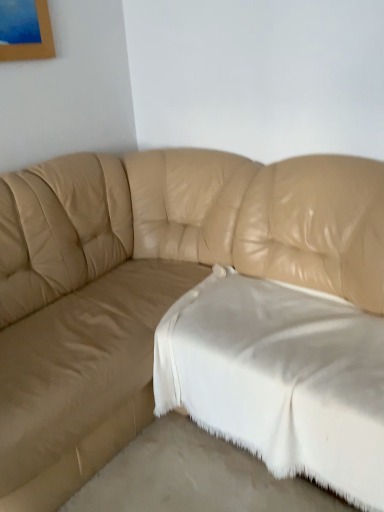
Question: From a real-world perspective, is white soft fabric at lower right located higher than white fabric at lower center?

Choices:
 (A) yes
 (B) no

Answer: (A)

Question: Is the depth of white soft fabric at lower right less than that of white fabric at lower center?

Choices:
 (A) no
 (B) yes

Answer: (A)

Question: From the image's perspective, is white soft fabric at lower right located above white fabric at lower center?

Choices:
 (A) no
 (B) yes

Answer: (B)

Question: Does white soft fabric at lower right have a smaller size compared to white fabric at lower center?

Choices:
 (A) yes
 (B) no

Answer: (B)

Question: Is white soft fabric at lower right wider than white fabric at lower center?

Choices:
 (A) yes
 (B) no

Answer: (A)

Question: Is white soft fabric at lower right oriented away from white fabric at lower center?

Choices:
 (A) no
 (B) yes

Answer: (A)

Question: Is the position of tan leather couch at center more distant than that of white fabric at lower center?

Choices:
 (A) yes
 (B) no

Answer: (B)

Question: Is tan leather couch at center taller than white fabric at lower center?

Choices:
 (A) yes
 (B) no

Answer: (A)

Question: From the image's perspective, does tan leather couch at center appear higher than white fabric at lower center?

Choices:
 (A) no
 (B) yes

Answer: (B)

Question: From a real-world perspective, is tan leather couch at center positioned over white fabric at lower center based on gravity?

Choices:
 (A) no
 (B) yes

Answer: (B)

Question: Is tan leather couch at center at the right side of white fabric at lower center?

Choices:
 (A) yes
 (B) no

Answer: (B)

Question: Does tan leather couch at center have a larger size compared to white fabric at lower center?

Choices:
 (A) no
 (B) yes

Answer: (B)

Question: From the image's perspective, is white soft fabric at lower right located above tan leather couch at center?

Choices:
 (A) no
 (B) yes

Answer: (A)